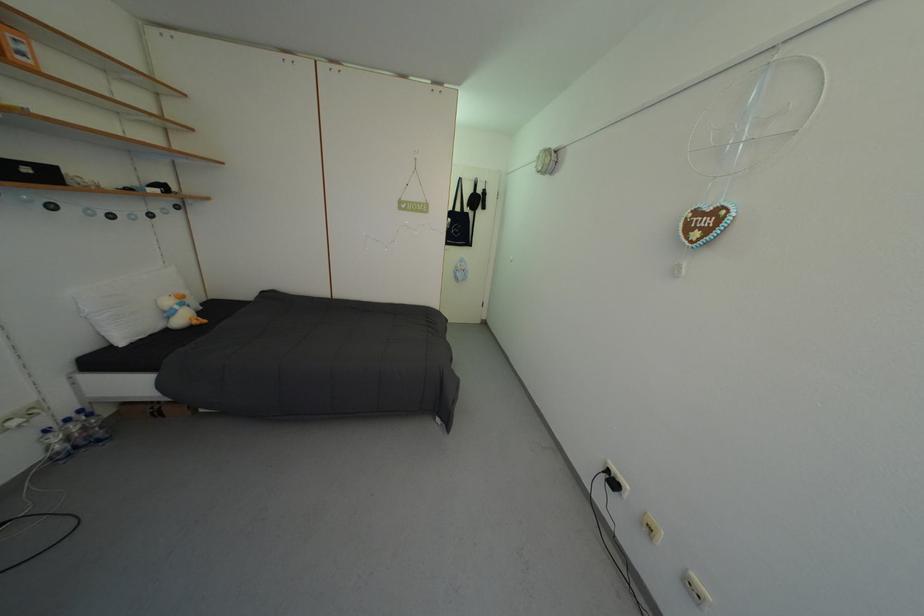
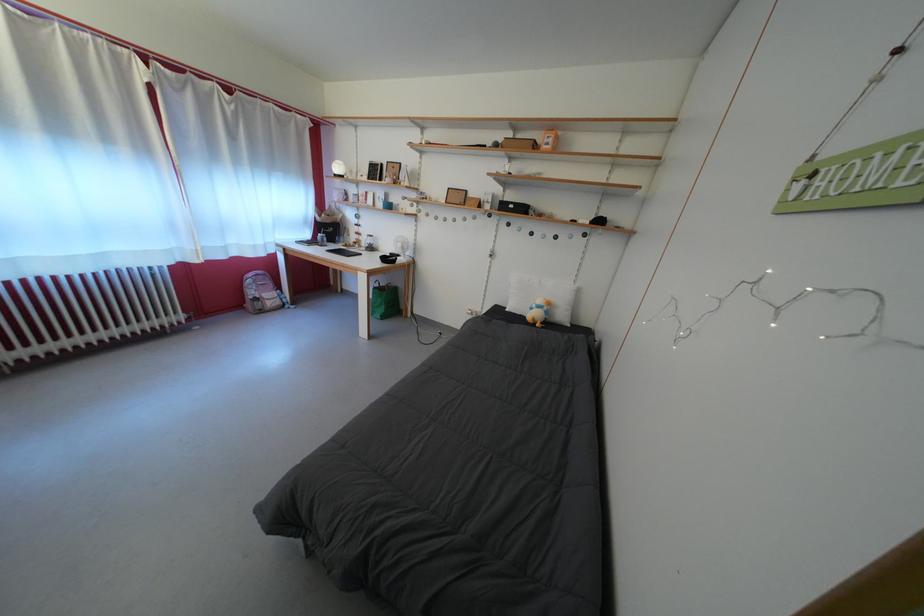
Where in the second image is the point corresponding to point (186, 313) from the first image?

(542, 312)